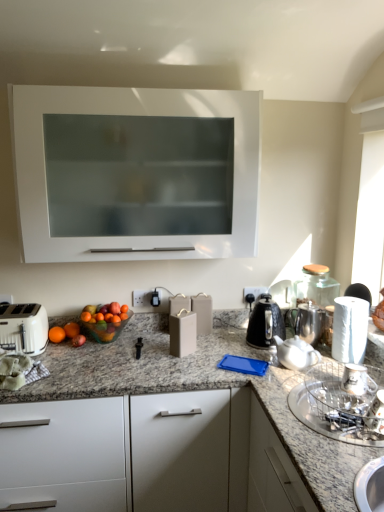
Question: Considering the positions of point (365, 331) and point (36, 352), is point (365, 331) closer or farther from the camera than point (36, 352)?

Choices:
 (A) closer
 (B) farther

Answer: (A)

Question: Is white paper towel at right spatially inside white plastic toaster at lower left, or outside of it?

Choices:
 (A) inside
 (B) outside

Answer: (B)

Question: Which object is positioned farthest from the white matte cabinet at lower left, the 2th cabinetry viewed from the top?

Choices:
 (A) white plastic toaster at lower left
 (B) white matte cabinet at upper center, positioned as the first cabinetry in top-to-bottom order
 (C) white paper towel at right
 (D) matte gray wine box at center, which appears as the third appliance when viewed from the right
 (E) white ceramic teapot at right

Answer: (B)

Question: Based on their relative distances, which object is farther from the white matte cabinet at upper center, which appears as the 2th cabinetry when ordered from the bottom?

Choices:
 (A) metallic silver cup at lower right, the second appliance positioned from the front
 (B) white matte cabinet at lower left, which appears as the first cabinetry when ordered from the bottom
 (C) white ceramic teapot at right
 (D) satin silver coffee pot at right
 (E) black metallic kettle at right

Answer: (A)